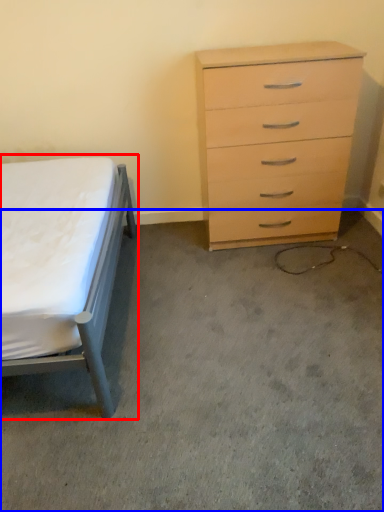
Question: Which of the following is the closest to the observer, bed (highlighted by a red box) or concrete (highlighted by a blue box)?

Choices:
 (A) bed
 (B) concrete

Answer: (A)